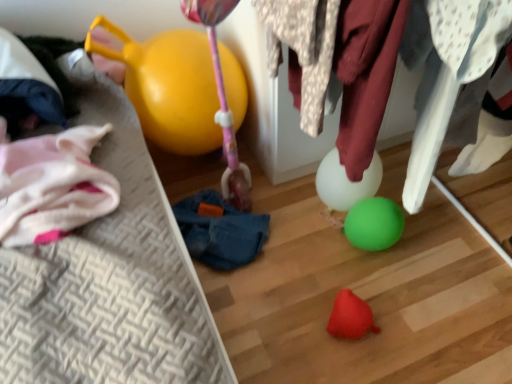
Question: Considering the relative sizes of rubber red toy at lower center and yellow rubber balloon at upper left in the image provided, is rubber red toy at lower center shorter than yellow rubber balloon at upper left?

Choices:
 (A) no
 (B) yes

Answer: (B)

Question: Could yellow rubber balloon at upper left be considered to be inside rubber red toy at lower center?

Choices:
 (A) no
 (B) yes

Answer: (A)

Question: Could you tell me if rubber red toy at lower center is facing yellow rubber balloon at upper left?

Choices:
 (A) yes
 (B) no

Answer: (B)

Question: Is rubber red toy at lower center far away from yellow rubber balloon at upper left?

Choices:
 (A) yes
 (B) no

Answer: (B)

Question: From the image's perspective, is rubber red toy at lower center on yellow rubber balloon at upper left?

Choices:
 (A) yes
 (B) no

Answer: (B)

Question: From the image's perspective, would you say rubber red toy at lower center is shown under yellow rubber balloon at upper left?

Choices:
 (A) yes
 (B) no

Answer: (A)

Question: Considering the relative positions of white fabric at upper right, marked as the first clothing in a right-to-left arrangement, and blue fabric bean bag chair at center in the image provided, is white fabric at upper right, marked as the first clothing in a right-to-left arrangement, to the right of blue fabric bean bag chair at center from the viewer's perspective?

Choices:
 (A) yes
 (B) no

Answer: (A)

Question: Does white fabric at upper right, marked as the first clothing in a right-to-left arrangement, have a greater width compared to blue fabric bean bag chair at center?

Choices:
 (A) yes
 (B) no

Answer: (B)

Question: From a real-world perspective, is white fabric at upper right, marked as the first clothing in a right-to-left arrangement, physically below blue fabric bean bag chair at center?

Choices:
 (A) no
 (B) yes

Answer: (A)

Question: Is the position of white fabric at upper right, marked as the first clothing in a right-to-left arrangement, more distant than that of blue fabric bean bag chair at center?

Choices:
 (A) no
 (B) yes

Answer: (A)

Question: Would you consider white fabric at upper right, marked as the first clothing in a right-to-left arrangement, to be distant from blue fabric bean bag chair at center?

Choices:
 (A) no
 (B) yes

Answer: (A)

Question: Is white fabric at upper right, the 2th clothing viewed from the left, thinner than blue fabric bean bag chair at center?

Choices:
 (A) yes
 (B) no

Answer: (A)

Question: Does rubber red toy at lower center have a larger size compared to white fabric at upper right, marked as the first clothing in a right-to-left arrangement?

Choices:
 (A) no
 (B) yes

Answer: (A)